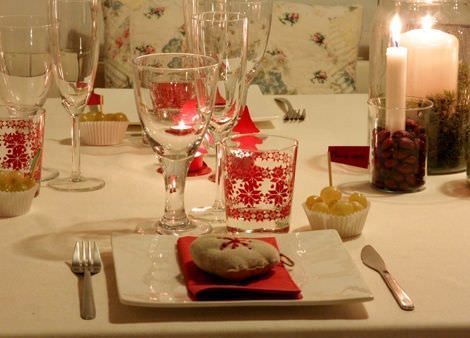
The height and width of the screenshot is (338, 470). Identify the location of cupcake holders and glass vases. (357, 220), (98, 127), (13, 203), (418, 112), (374, 62).